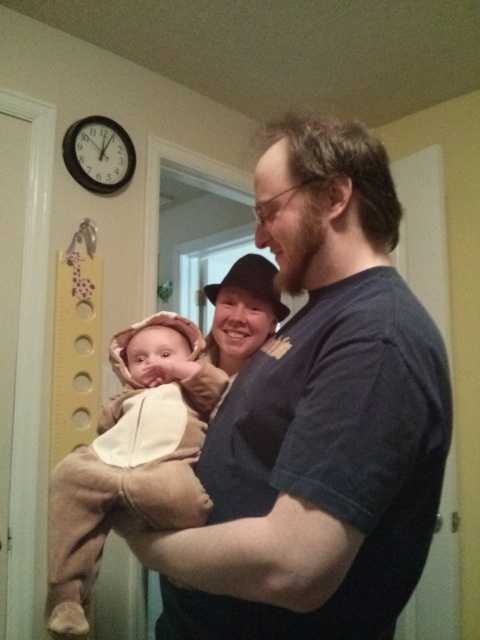
Question: Where is dark blue t-shirt at center located in relation to black plastic clock at upper left in the image?

Choices:
 (A) above
 (B) below

Answer: (B)

Question: Can you confirm if dark blue t-shirt at center is positioned to the right of black plastic clock at upper left?

Choices:
 (A) yes
 (B) no

Answer: (A)

Question: Is dark blue t-shirt at center wider than soft beige costume at center?

Choices:
 (A) yes
 (B) no

Answer: (A)

Question: Which object appears closest to the camera in this image?

Choices:
 (A) black plastic clock at upper left
 (B) dark blue t-shirt at center

Answer: (B)

Question: Considering the real-world distances, which object is closest to the black plastic clock at upper left?

Choices:
 (A) soft beige costume at center
 (B) dark blue t-shirt at center

Answer: (A)

Question: Which of the following is the farthest from the observer?

Choices:
 (A) (92, 156)
 (B) (301, 547)
 (C) (218, 378)

Answer: (A)